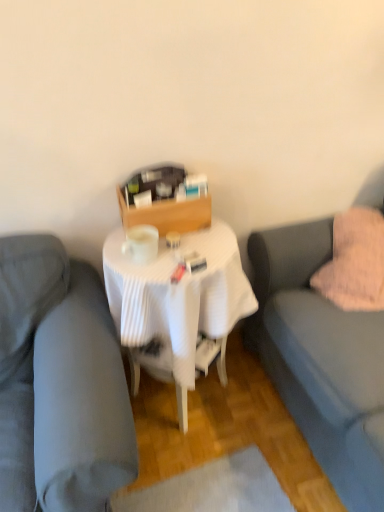
At what (x,y) coordinates should I click in order to perform the action: click on free space below white pleated tablecloth at center (from a real-world perspective). Please return your answer as a coordinate pair (x, y). Looking at the image, I should click on (190, 407).